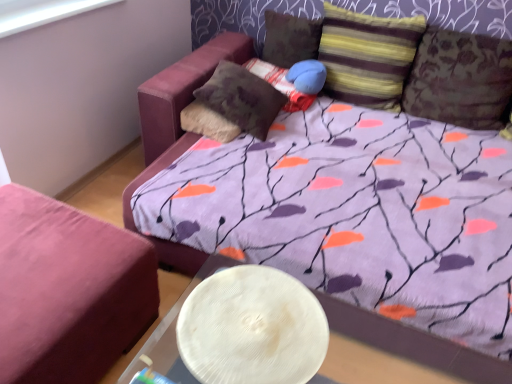
Locate an element on the screen. Image resolution: width=512 pixels, height=384 pixels. free space above velvet pink ottoman at lower left (from a real-world perspective) is located at coordinates (41, 246).